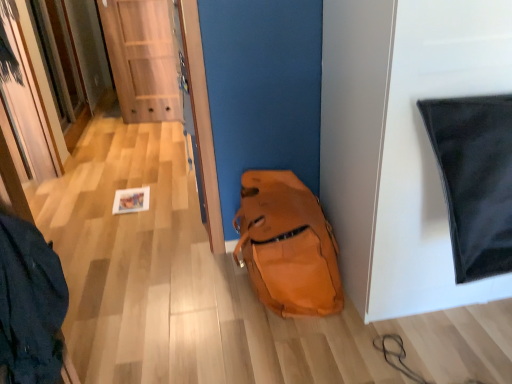
Question: From the image's perspective, is wooden door at center located beneath orange leather backpack at lower center?

Choices:
 (A) no
 (B) yes

Answer: (A)

Question: Is wooden door at center taller than orange leather backpack at lower center?

Choices:
 (A) no
 (B) yes

Answer: (B)

Question: Are wooden door at center and orange leather backpack at lower center far apart?

Choices:
 (A) yes
 (B) no

Answer: (A)

Question: Is wooden door at center located outside orange leather backpack at lower center?

Choices:
 (A) yes
 (B) no

Answer: (A)

Question: Is wooden door at center shorter than orange leather backpack at lower center?

Choices:
 (A) no
 (B) yes

Answer: (A)

Question: Is wooden door at center facing away from orange leather backpack at lower center?

Choices:
 (A) no
 (B) yes

Answer: (A)

Question: Considering the relative sizes of orange leather backpack at lower center and wooden door at center in the image provided, is orange leather backpack at lower center taller than wooden door at center?

Choices:
 (A) yes
 (B) no

Answer: (B)

Question: Does orange leather backpack at lower center have a lesser width compared to wooden door at center?

Choices:
 (A) yes
 (B) no

Answer: (B)

Question: From a real-world perspective, is orange leather backpack at lower center physically above wooden door at center?

Choices:
 (A) yes
 (B) no

Answer: (B)

Question: Can you confirm if orange leather backpack at lower center is positioned to the left of wooden door at center?

Choices:
 (A) no
 (B) yes

Answer: (A)

Question: Is orange leather backpack at lower center completely or partially outside of wooden door at center?

Choices:
 (A) no
 (B) yes

Answer: (B)

Question: Can you confirm if orange leather backpack at lower center is smaller than wooden door at center?

Choices:
 (A) no
 (B) yes

Answer: (A)

Question: From a real-world perspective, relative to wooden door at center, is orange leather backpack at lower center vertically above or below?

Choices:
 (A) above
 (B) below

Answer: (B)